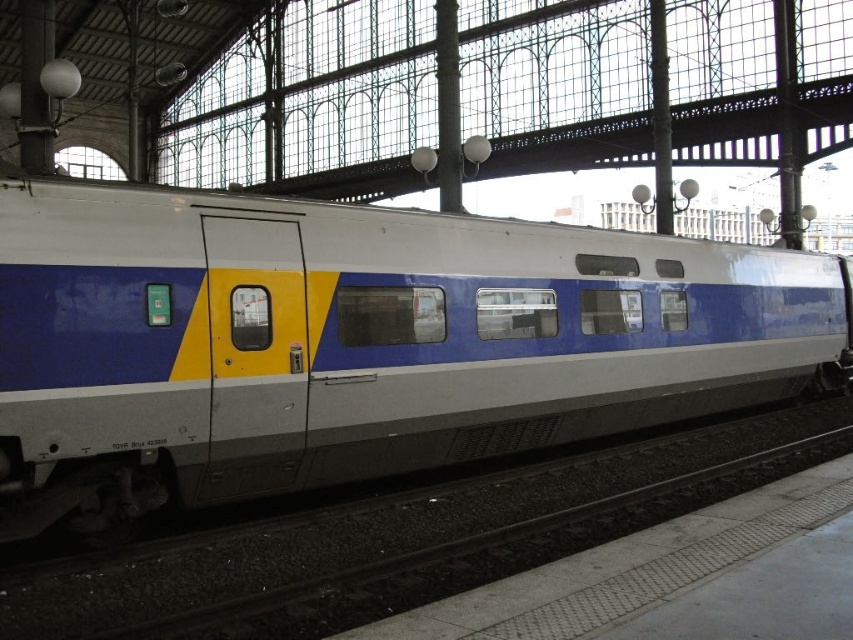
You are a maintenance worker checking the train alignment. The train must be exactly on the track to ensure safe operation. Is the matte white train at center properly aligned with the metallic gray track at lower center?

The matte white train at center is positioned over metallic gray track at lower center, so it is properly aligned.

You are a maintenance worker in the train station. You need to check the distance between the matte white train at center and the metallic gray track at lower center. Can you estimate if the train is longer than the track?

The matte white train at center has a larger size compared to metallic gray track at lower center, so yes, the train is longer than the track.